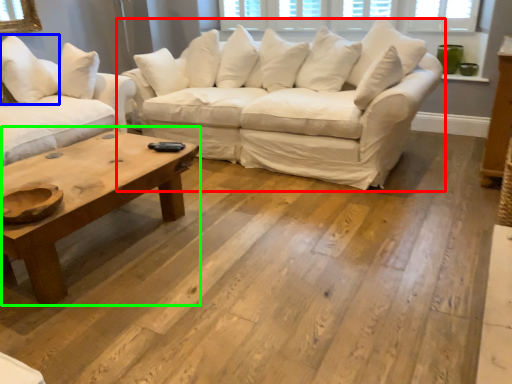
Question: Considering the real-world distances, which object is closest to studio couch (highlighted by a red box)? pillow (highlighted by a blue box) or coffee table (highlighted by a green box).

Choices:
 (A) pillow
 (B) coffee table

Answer: (B)